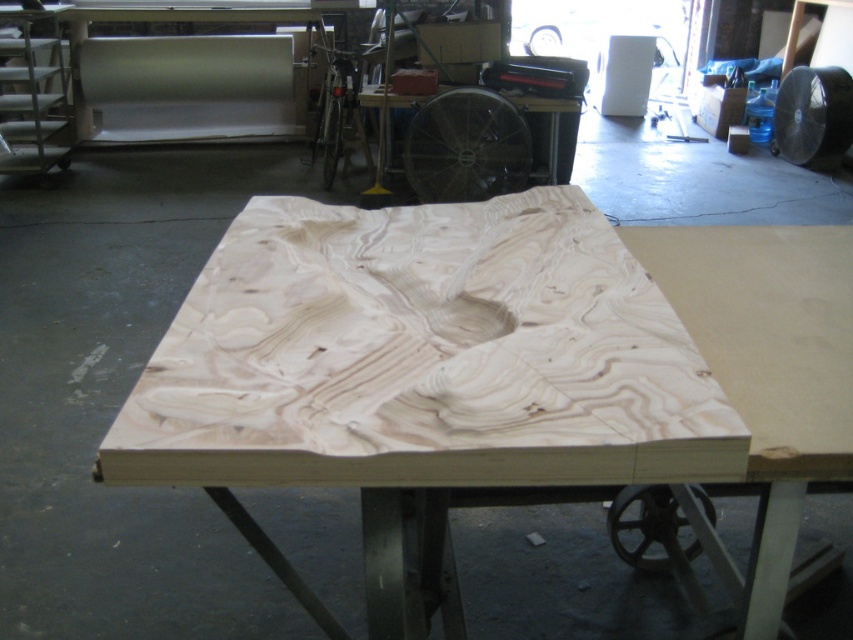
Question: Does natural wood plywood at center appear on the left side of natural wood table at center?

Choices:
 (A) no
 (B) yes

Answer: (B)

Question: Among these objects, which one is nearest to the camera?

Choices:
 (A) natural wood plywood at center
 (B) natural wood table at center

Answer: (A)

Question: Can you confirm if natural wood plywood at center is bigger than natural wood table at center?

Choices:
 (A) yes
 (B) no

Answer: (A)

Question: Is natural wood plywood at center smaller than natural wood table at center?

Choices:
 (A) yes
 (B) no

Answer: (B)